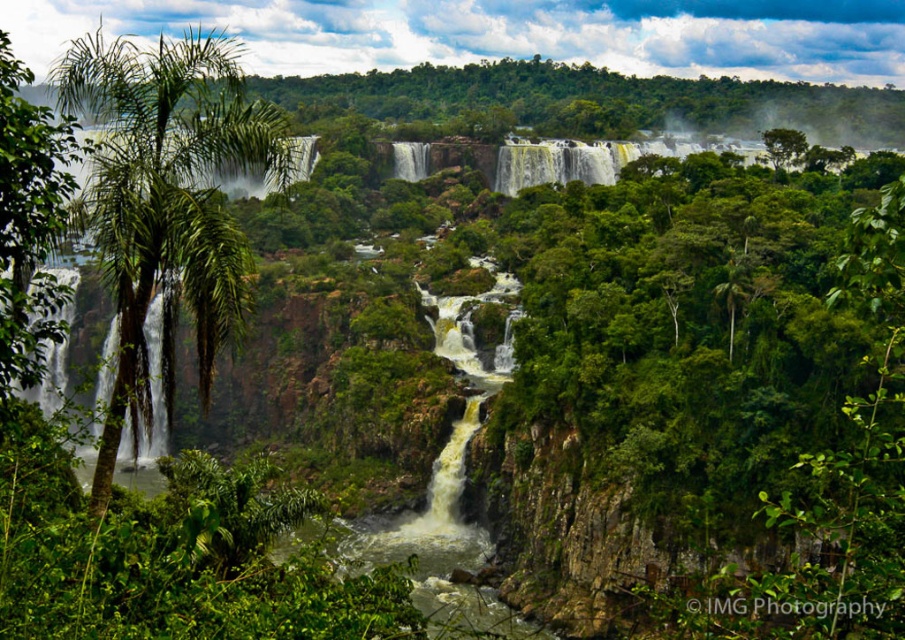
Which of these two, green leafy palm tree at left or green leafy tree at left, stands shorter?

green leafy tree at left is shorter.

This screenshot has height=640, width=905. I want to click on green leafy palm tree at left, so click(167, 200).

Does point (176, 65) lie in front of point (18, 136)?

No, it is behind (18, 136).

I want to click on green leafy palm tree at left, so click(x=167, y=200).